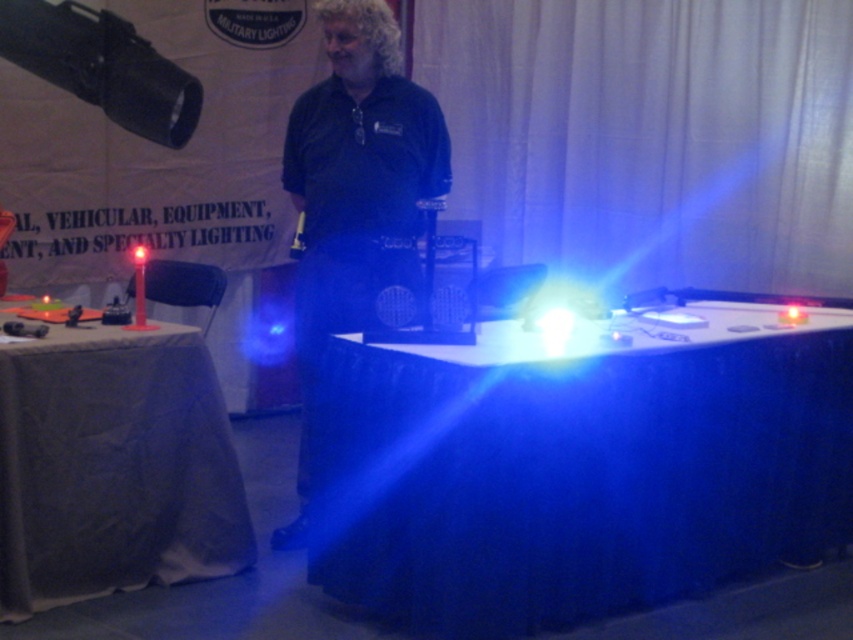
Question: Is blue fabric table at center wider than dark blue shirt at center?

Choices:
 (A) yes
 (B) no

Answer: (A)

Question: Which is farther from the dark blue shirt at center?

Choices:
 (A) white cloth table at left
 (B) blue fabric table at center

Answer: (B)

Question: Among these points, which one is nearest to the camera?

Choices:
 (A) (427, 173)
 (B) (181, 333)
 (C) (548, 432)

Answer: (C)

Question: Does blue fabric table at center appear under dark blue shirt at center?

Choices:
 (A) no
 (B) yes

Answer: (B)

Question: Does blue fabric table at center have a larger size compared to white cloth table at left?

Choices:
 (A) yes
 (B) no

Answer: (A)

Question: Which of the following is the farthest from the observer?

Choices:
 (A) blue fabric table at center
 (B) dark blue shirt at center

Answer: (B)